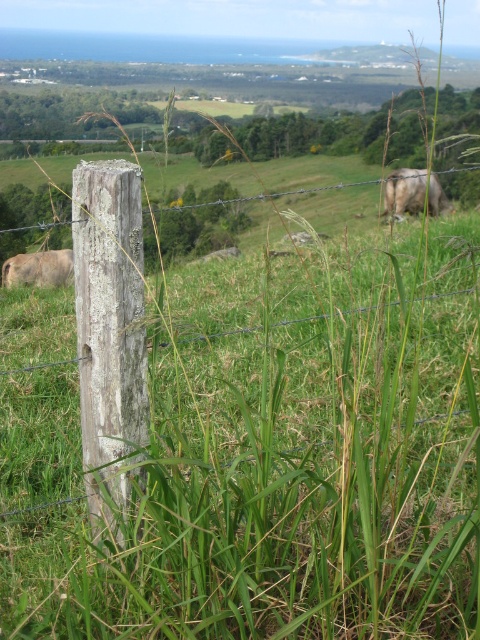
Which is behind, point (415, 209) or point (36, 284)?

The point (415, 209) is behind.

Is point (434, 205) positioned behind point (34, 268)?

Yes, it is.

Where is `white woolly cow at upper right`? The image size is (480, 640). white woolly cow at upper right is located at coordinates (412, 193).